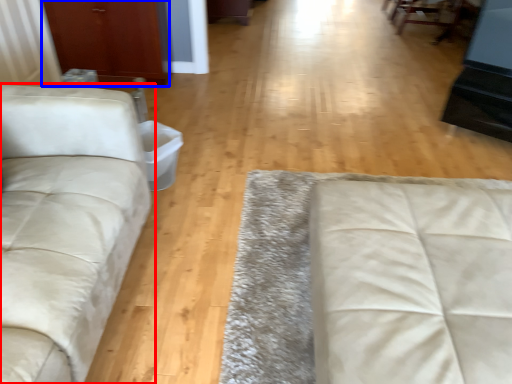
Question: Among these objects, which one is farthest to the camera, studio couch (highlighted by a red box) or armoire (highlighted by a blue box)?

Choices:
 (A) studio couch
 (B) armoire

Answer: (B)